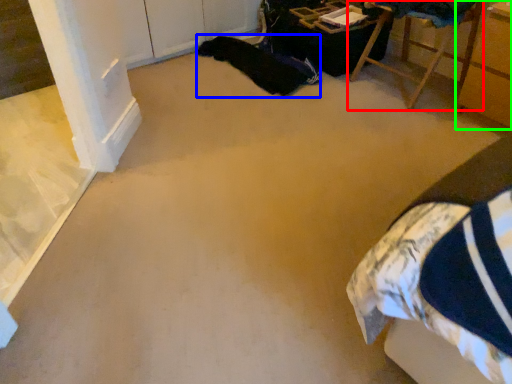
Question: Which is nearer to the furniture (highlighted by a red box)? blanket (highlighted by a blue box) or furniture (highlighted by a green box).

Choices:
 (A) blanket
 (B) furniture

Answer: (B)